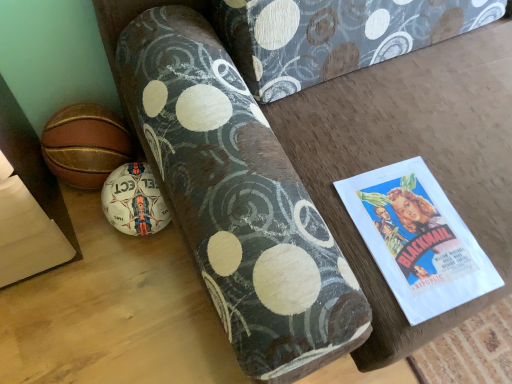
Question: Considering the relative positions of white matte soccer ball at lower left, the second ball in the top-to-bottom sequence, and leather basketball at lower left, placed as the first ball when sorted from top to bottom, in the image provided, is white matte soccer ball at lower left, the second ball in the top-to-bottom sequence, to the right of leather basketball at lower left, placed as the first ball when sorted from top to bottom, from the viewer's perspective?

Choices:
 (A) yes
 (B) no

Answer: (A)

Question: Is white matte soccer ball at lower left, the second ball in the top-to-bottom sequence, oriented towards leather basketball at lower left, placed as the first ball when sorted from top to bottom?

Choices:
 (A) yes
 (B) no

Answer: (B)

Question: Is white matte soccer ball at lower left, marked as the first ball in a bottom-to-top arrangement, closer to the viewer compared to leather basketball at lower left, arranged as the second ball when ordered from the bottom?

Choices:
 (A) yes
 (B) no

Answer: (A)

Question: From the image's perspective, is white matte soccer ball at lower left, marked as the first ball in a bottom-to-top arrangement, below leather basketball at lower left, arranged as the second ball when ordered from the bottom?

Choices:
 (A) no
 (B) yes

Answer: (B)

Question: From a real-world perspective, is white matte soccer ball at lower left, marked as the first ball in a bottom-to-top arrangement, positioned over leather basketball at lower left, arranged as the second ball when ordered from the bottom, based on gravity?

Choices:
 (A) no
 (B) yes

Answer: (A)

Question: Can leather basketball at lower left, arranged as the second ball when ordered from the bottom, be found inside white matte soccer ball at lower left, the second ball in the top-to-bottom sequence?

Choices:
 (A) yes
 (B) no

Answer: (B)

Question: Considering the relative sizes of leather basketball at lower left, placed as the first ball when sorted from top to bottom, and white matte soccer ball at lower left, marked as the first ball in a bottom-to-top arrangement, in the image provided, is leather basketball at lower left, placed as the first ball when sorted from top to bottom, wider than white matte soccer ball at lower left, marked as the first ball in a bottom-to-top arrangement,?

Choices:
 (A) no
 (B) yes

Answer: (A)

Question: From the image's perspective, does leather basketball at lower left, placed as the first ball when sorted from top to bottom, appear lower than white matte soccer ball at lower left, the second ball in the top-to-bottom sequence?

Choices:
 (A) yes
 (B) no

Answer: (B)

Question: From the image's perspective, is leather basketball at lower left, placed as the first ball when sorted from top to bottom, above white matte soccer ball at lower left, marked as the first ball in a bottom-to-top arrangement?

Choices:
 (A) no
 (B) yes

Answer: (B)

Question: Is leather basketball at lower left, arranged as the second ball when ordered from the bottom, smaller than white matte soccer ball at lower left, marked as the first ball in a bottom-to-top arrangement?

Choices:
 (A) no
 (B) yes

Answer: (A)

Question: Is leather basketball at lower left, arranged as the second ball when ordered from the bottom, shorter than white matte soccer ball at lower left, marked as the first ball in a bottom-to-top arrangement?

Choices:
 (A) no
 (B) yes

Answer: (B)

Question: From a real-world perspective, does leather basketball at lower left, placed as the first ball when sorted from top to bottom, stand above white matte soccer ball at lower left, the second ball in the top-to-bottom sequence?

Choices:
 (A) yes
 (B) no

Answer: (A)

Question: Does point (76, 127) appear closer or farther from the camera than point (154, 205)?

Choices:
 (A) farther
 (B) closer

Answer: (A)